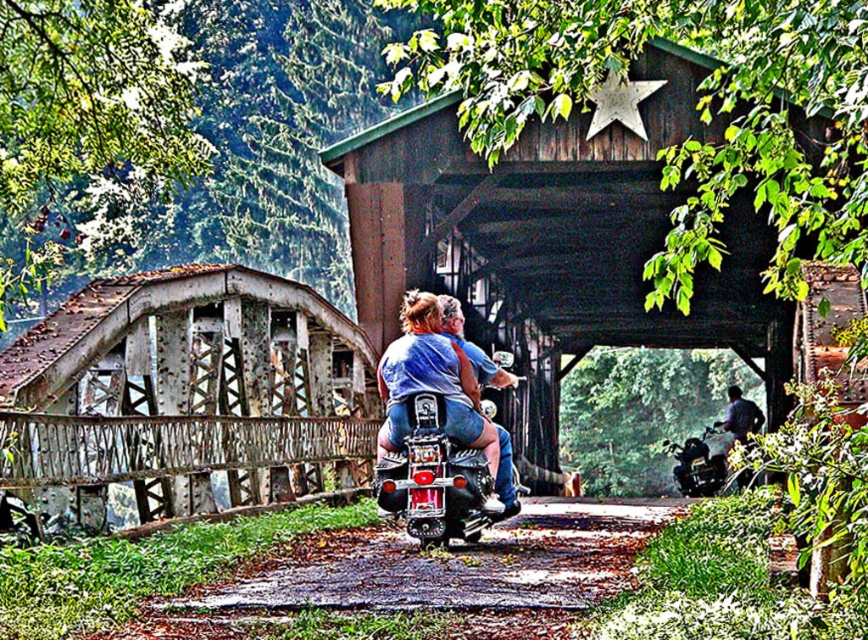
Which is more to the right, rusty metal bridge at left or matte blue jeans at center?

Positioned to the right is matte blue jeans at center.

From the picture: Can you confirm if rusty metal bridge at left is smaller than matte blue jeans at center?

No.

What do you see at coordinates (185, 392) in the screenshot?
I see `rusty metal bridge at left` at bounding box center [185, 392].

Locate an element on the screen. The height and width of the screenshot is (640, 868). rusty metal bridge at left is located at coordinates (185, 392).

Between rusty metal bridge at left and dark blue jeans at lower right, which one appears on the right side from the viewer's perspective?

From the viewer's perspective, dark blue jeans at lower right appears more on the right side.

Does rusty metal bridge at left have a greater width compared to dark blue jeans at lower right?

Yes, rusty metal bridge at left is wider than dark blue jeans at lower right.

Which is in front, point (232, 458) or point (740, 406)?

Point (232, 458)

You are a GUI agent. You are given a task and a screenshot of the screen. Output one action in this format:
    pyautogui.click(x=<x>, y=<y>)
    Task: Click on the rusty metal bridge at left
    The height and width of the screenshot is (640, 868).
    Given the screenshot: What is the action you would take?
    pyautogui.click(x=185, y=392)

Is matte blue jeans at center thinner than dark blue jeans at lower right?

Indeed, matte blue jeans at center has a lesser width compared to dark blue jeans at lower right.

Is point (403, 362) less distant than point (760, 412)?

Yes, point (403, 362) is in front of point (760, 412).

What do you see at coordinates (444, 388) in the screenshot? The width and height of the screenshot is (868, 640). I see `matte blue jeans at center` at bounding box center [444, 388].

Locate an element on the screen. The height and width of the screenshot is (640, 868). matte blue jeans at center is located at coordinates (444, 388).